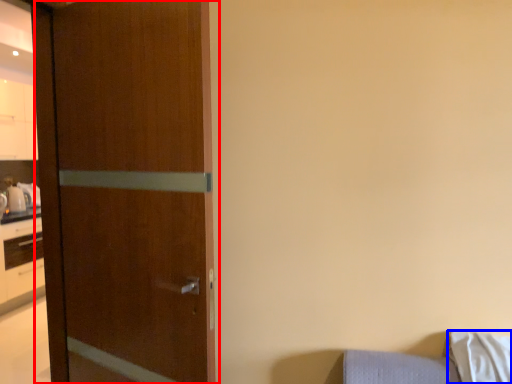
Question: Which of the following is the closest to the observer, door (highlighted by a red box) or pillow (highlighted by a blue box)?

Choices:
 (A) door
 (B) pillow

Answer: (A)